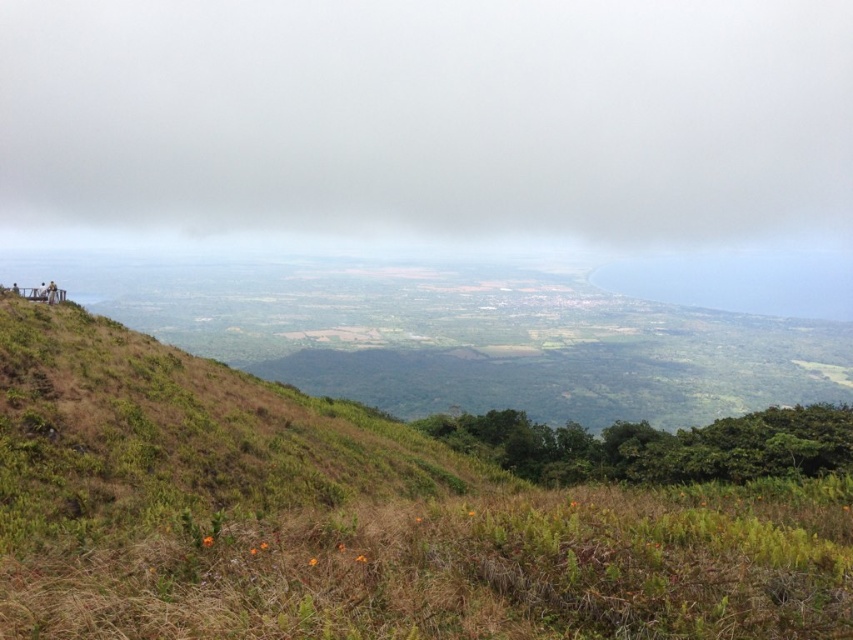
Question: Is white fluffy cloud at upper center bigger than dry grass at lower center?

Choices:
 (A) no
 (B) yes

Answer: (B)

Question: Among these objects, which one is farthest from the camera?

Choices:
 (A) white fluffy cloud at upper center
 (B) dry grass at lower center

Answer: (A)

Question: Among these points, which one is nearest to the camera?

Choices:
 (A) (843, 556)
 (B) (631, 196)

Answer: (A)

Question: Is white fluffy cloud at upper center bigger than dry grass at lower center?

Choices:
 (A) no
 (B) yes

Answer: (B)

Question: From the image, what is the correct spatial relationship of white fluffy cloud at upper center in relation to dry grass at lower center?

Choices:
 (A) below
 (B) above

Answer: (B)